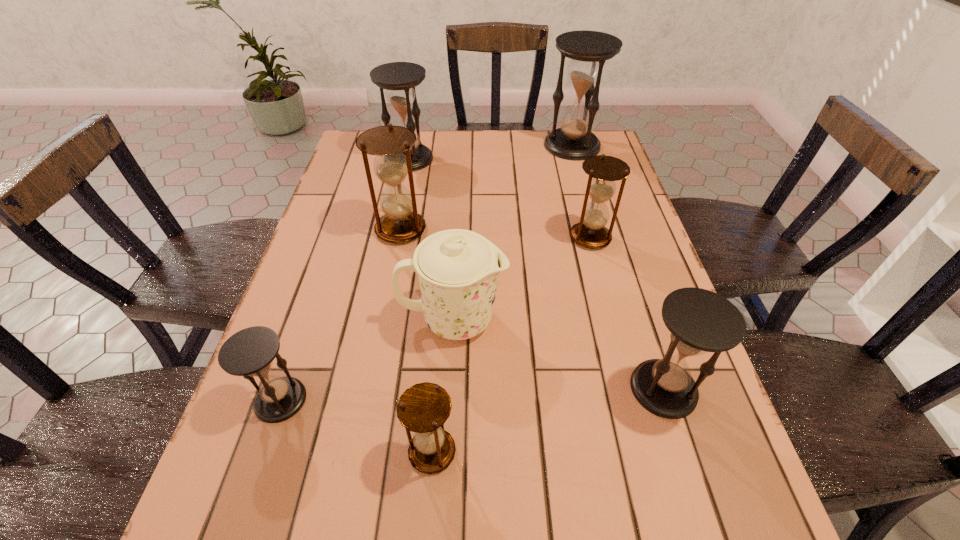
Locate an element on the screen. The height and width of the screenshot is (540, 960). vacant point that satisfies the following two spatial constraints: 1. on the spout of the fourth nearest object; 2. on the back side of the second smallest black hourglass is located at coordinates (449, 389).

The image size is (960, 540). I want to click on vacant space that satisfies the following two spatial constraints: 1. on the back side of the rightmost brown hourglass; 2. on the left side of the tallest hourglass, so click(x=566, y=146).